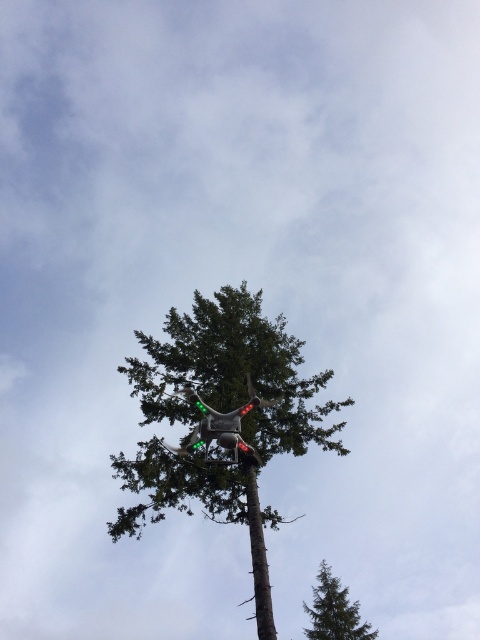
Can you confirm if green matte drone at center is taller than green matte tree at center?

Yes, green matte drone at center is taller than green matte tree at center.

Where is `green matte drone at center`? green matte drone at center is located at coordinates (233, 372).